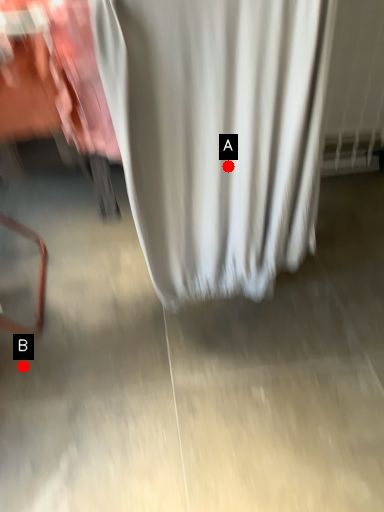
Question: Two points are circled on the image, labeled by A and B beside each circle. Which point is further to the camera?

Choices:
 (A) A is further
 (B) B is further

Answer: (B)